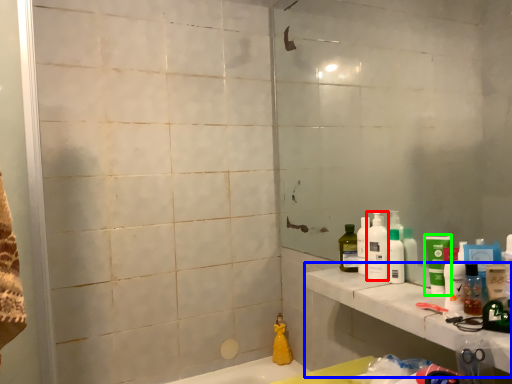
Question: Considering the real-world distances, which object is farthest from cleaning product (highlighted by a red box)? counter top (highlighted by a blue box) or mouthwash (highlighted by a green box)?

Choices:
 (A) counter top
 (B) mouthwash

Answer: (A)